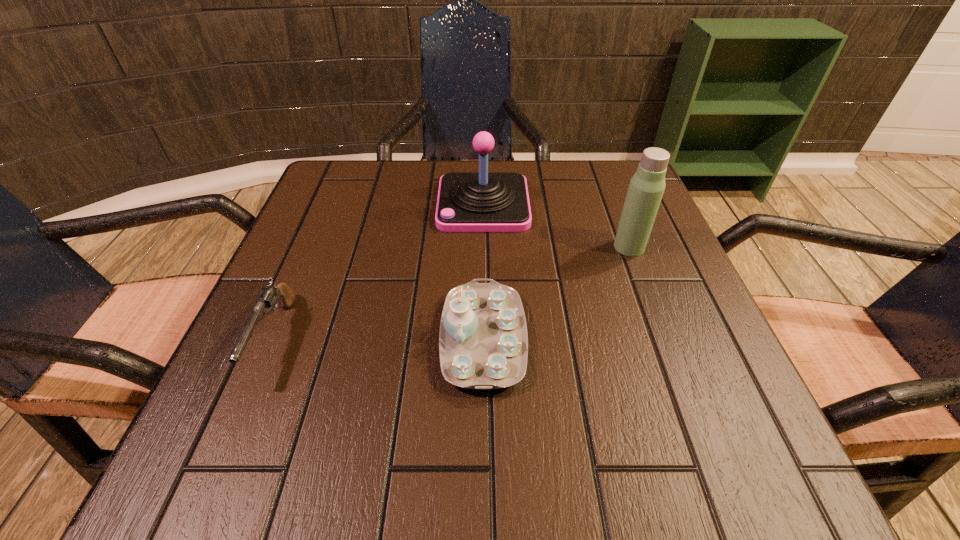
The image size is (960, 540). Find the location of `thermos bottle`. thermos bottle is located at coordinates (646, 187).

I want to click on the rightmost object, so click(646, 187).

At what (x,y) coordinates should I click in order to perform the action: click on joystick. Please return your answer as a coordinate pair (x, y). This screenshot has height=540, width=960. Looking at the image, I should click on (483, 201).

Image resolution: width=960 pixels, height=540 pixels. I want to click on the farthest object, so click(483, 201).

I want to click on chinaware, so click(483, 343).

At what (x,y) coordinates should I click in order to perform the action: click on gun. Please return your answer as a coordinate pair (x, y). Looking at the image, I should click on (269, 295).

I want to click on free space located 0.260m on the front of the tallest object, so click(x=676, y=372).

Identify the location of blank area located forward from the base of the farthest object. (316, 204).

Locate an element on the screen. This screenshot has height=540, width=960. vacant space located forward from the base of the farthest object is located at coordinates (402, 204).

Image resolution: width=960 pixels, height=540 pixels. I want to click on blank space located forward from the base of the farthest object, so click(370, 204).